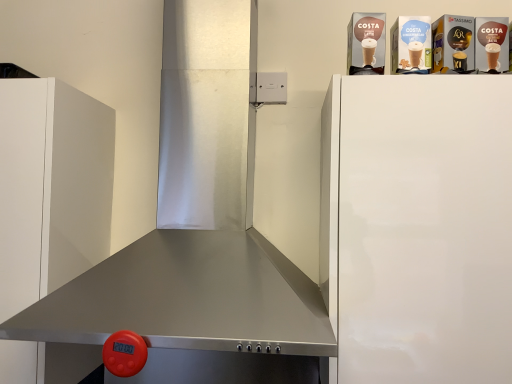
Question: Is stainless steel exhaust hood at center a part of white matte cabinet at left?

Choices:
 (A) yes
 (B) no

Answer: (B)

Question: Is white matte cabinet at left placed right next to stainless steel exhaust hood at center?

Choices:
 (A) yes
 (B) no

Answer: (B)

Question: Would you consider white matte cabinet at left to be distant from stainless steel exhaust hood at center?

Choices:
 (A) no
 (B) yes

Answer: (A)

Question: From a real-world perspective, is white matte cabinet at left over stainless steel exhaust hood at center?

Choices:
 (A) yes
 (B) no

Answer: (B)

Question: Is white matte cabinet at left facing towards stainless steel exhaust hood at center?

Choices:
 (A) no
 (B) yes

Answer: (A)

Question: Is white matte cabinet at left inside the boundaries of white glossy refrigerator at upper right, or outside?

Choices:
 (A) outside
 (B) inside

Answer: (A)

Question: In terms of height, does white matte cabinet at left look taller or shorter compared to white glossy refrigerator at upper right?

Choices:
 (A) short
 (B) tall

Answer: (B)

Question: Relative to white glossy refrigerator at upper right, is white matte cabinet at left in front or behind?

Choices:
 (A) front
 (B) behind

Answer: (B)

Question: Is point (44, 173) positioned closer to the camera than point (361, 117)?

Choices:
 (A) closer
 (B) farther

Answer: (B)

Question: In terms of size, does stainless steel exhaust hood at center appear bigger or smaller than white glossy refrigerator at upper right?

Choices:
 (A) big
 (B) small

Answer: (A)

Question: In the image, is stainless steel exhaust hood at center on the left side or the right side of white glossy refrigerator at upper right?

Choices:
 (A) right
 (B) left

Answer: (B)

Question: Would you say stainless steel exhaust hood at center is inside or outside white glossy refrigerator at upper right?

Choices:
 (A) outside
 (B) inside

Answer: (A)

Question: From the image's perspective, is stainless steel exhaust hood at center above or below white glossy refrigerator at upper right?

Choices:
 (A) above
 (B) below

Answer: (A)

Question: Is stainless steel exhaust hood at center bigger or smaller than white matte cabinet at left?

Choices:
 (A) small
 (B) big

Answer: (B)

Question: Would you say stainless steel exhaust hood at center is to the left or to the right of white matte cabinet at left in the picture?

Choices:
 (A) right
 (B) left

Answer: (A)